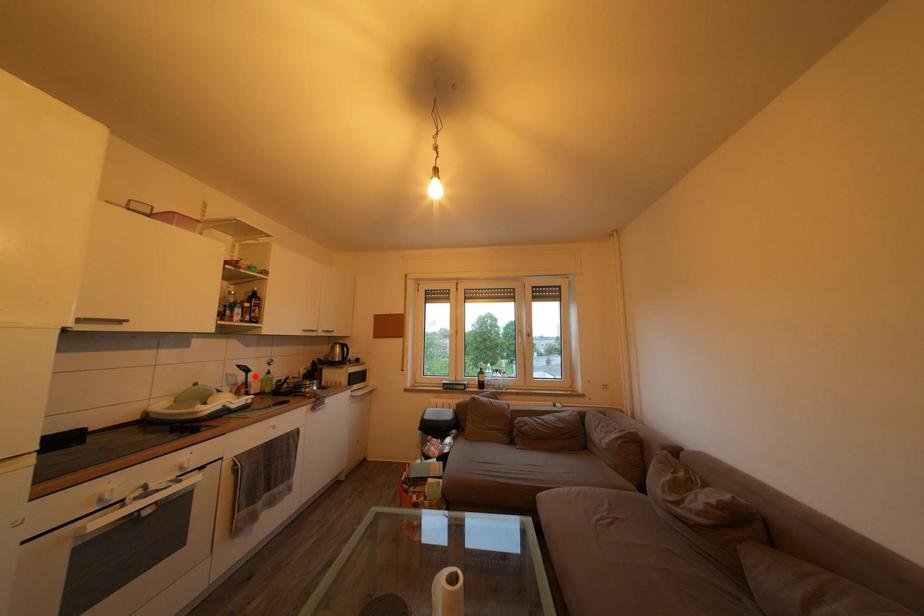
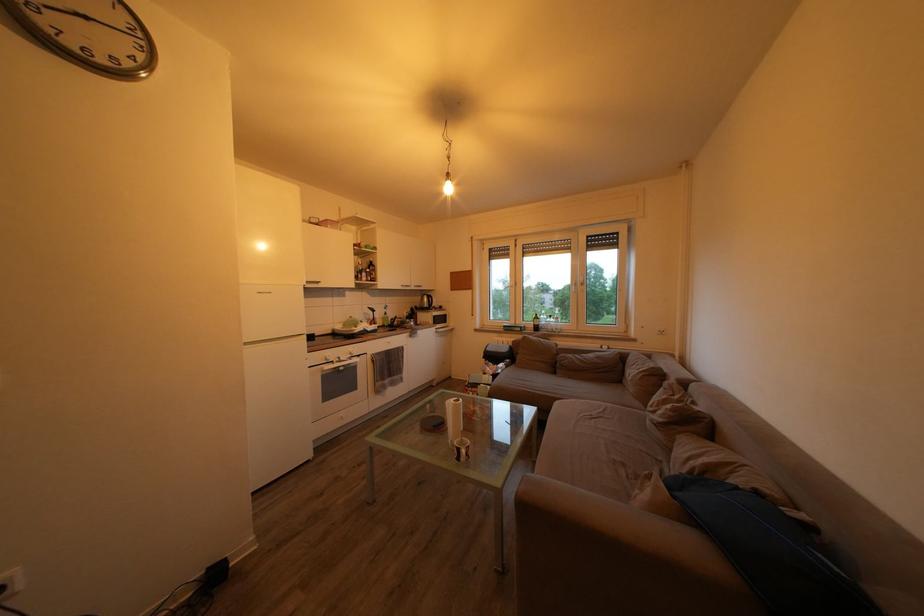
In the second image, find the point that corresponds to the highlighted location in the first image.

(381, 317)